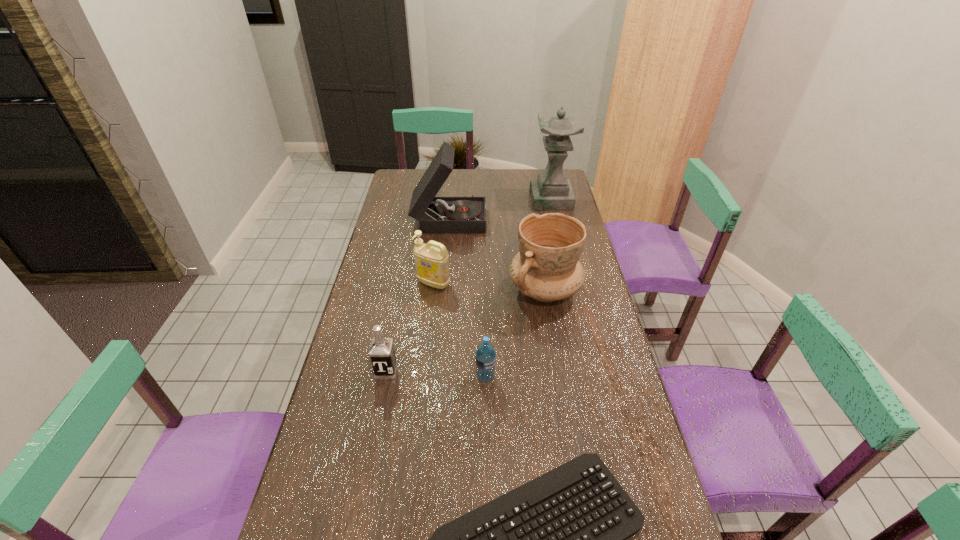
You are a GUI agent. You are given a task and a screenshot of the screen. Output one action in this format:
    pyautogui.click(x=<x>, y=<y>)
    Task: Click on the tallest object
    Image resolution: width=960 pixels, height=540 pixels.
    Given the screenshot: What is the action you would take?
    pyautogui.click(x=551, y=190)

Where is `phonograph_record`? phonograph_record is located at coordinates (x=465, y=214).

Identify the location of pottery. (547, 268).

Image resolution: width=960 pixels, height=540 pixels. What are the coordinates of `detergent` in the screenshot? It's located at pyautogui.click(x=431, y=260).

What are the coordinates of `vodka` in the screenshot? It's located at (381, 352).

Where is `water bottle`? This screenshot has width=960, height=540. water bottle is located at coordinates (485, 357).

Locate an element on the screen. This screenshot has height=540, width=960. vacant space located 0.270m at the front opening of the tallest object is located at coordinates (471, 199).

This screenshot has width=960, height=540. Identify the location of free region located 0.340m at the front opening of the tallest object. (456, 199).

I want to click on vacant space located at the front opening of the tallest object, so click(465, 199).

Where is `free region located on the front-facing side of the phonograph_record`? The image size is (960, 540). free region located on the front-facing side of the phonograph_record is located at coordinates (551, 217).